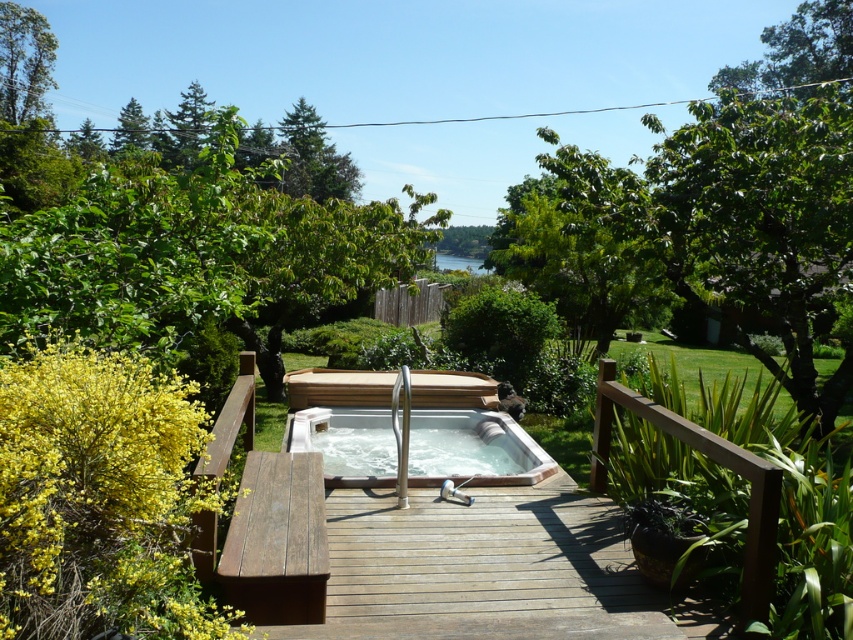
You are planning to install a new garden sprinkler system that has a maximum range of 25 meters. You want to ensure both the white glossy hot tub at center and the green leafy tree at upper left are within the sprinkler system coverage area. Is this possible?

The distance between the white glossy hot tub at center and the green leafy tree at upper left is 29.36 meters. Since the sprinkler system has a maximum range of 25 meters, it cannot cover both objects simultaneously as they are farther apart than the sprinkler range.